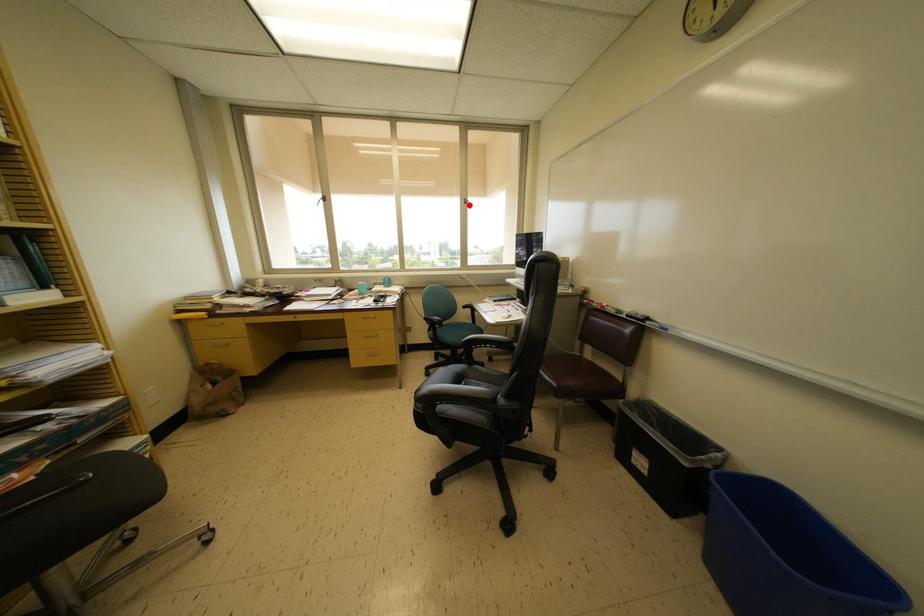
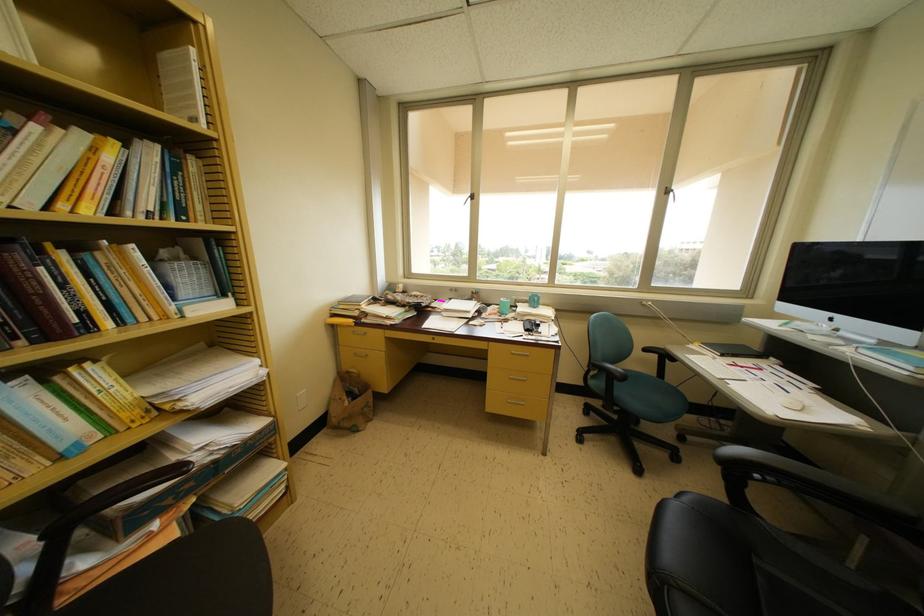
Locate, in the second image, the point that corresponds to the highlighted location in the first image.

(671, 193)